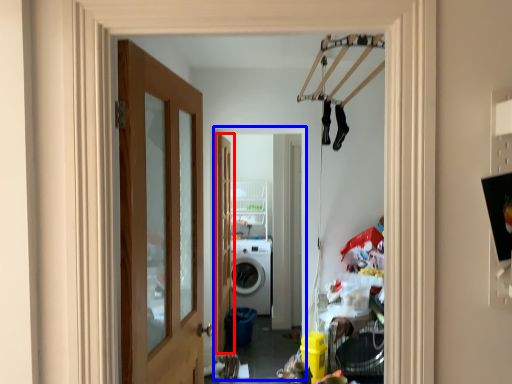
Question: Which point is further to the camera, door (highlighted by a red box) or corridor (highlighted by a blue box)?

Choices:
 (A) door
 (B) corridor

Answer: (A)